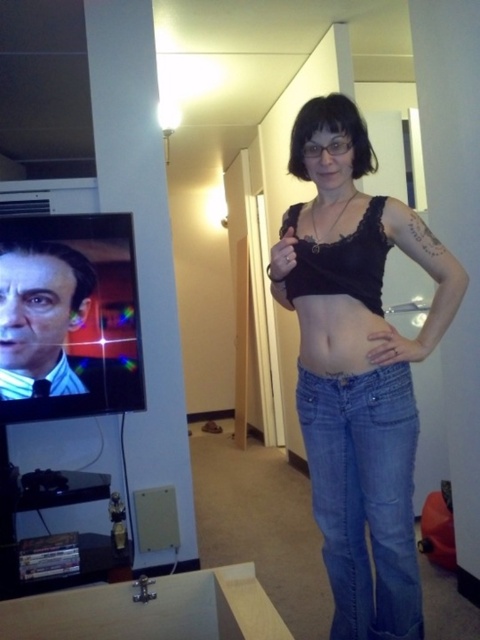
Can you confirm if black lace bikini top at center is positioned below matte black skin at center?

Incorrect, black lace bikini top at center is not positioned below matte black skin at center.

Based on the photo, can you confirm if black lace bikini top at center is shorter than matte black skin at center?

In fact, black lace bikini top at center may be taller than matte black skin at center.

Describe the element at coordinates (344, 262) in the screenshot. This screenshot has width=480, height=640. I see `black lace bikini top at center` at that location.

Locate an element on the screen. This screenshot has height=640, width=480. black lace bikini top at center is located at coordinates (344, 262).

Is point (328, 573) closer to viewer compared to point (319, 467)?

No, it is behind (319, 467).

Between black lace top at center and denim jeans at center, which one appears on the right side from the viewer's perspective?

black lace top at center is more to the right.

Image resolution: width=480 pixels, height=640 pixels. Describe the element at coordinates (358, 365) in the screenshot. I see `black lace top at center` at that location.

The width and height of the screenshot is (480, 640). Find the location of `black lace top at center`. black lace top at center is located at coordinates (358, 365).

Who is positioned more to the right, black lace top at center or matte black skin at center?

From the viewer's perspective, black lace top at center appears more on the right side.

Between point (324, 195) and point (336, 372), which one is positioned in front?

Point (336, 372) is in front.

Locate an element on the screen. black lace top at center is located at coordinates (358, 365).